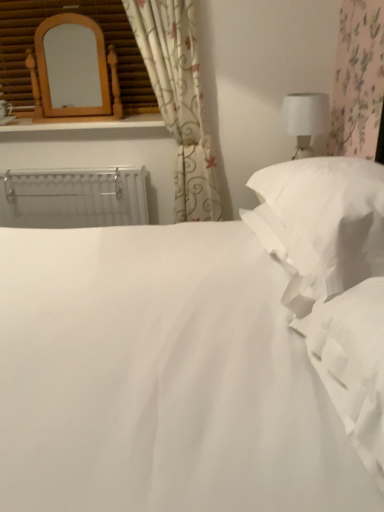
Question: Is white metallic radiator at left positioned in front of white fabric at right?

Choices:
 (A) no
 (B) yes

Answer: (A)

Question: Does white metallic radiator at left have a larger size compared to white fabric at right?

Choices:
 (A) no
 (B) yes

Answer: (B)

Question: Does white metallic radiator at left have a smaller size compared to white fabric at right?

Choices:
 (A) no
 (B) yes

Answer: (A)

Question: Is there a large distance between white metallic radiator at left and white fabric at right?

Choices:
 (A) yes
 (B) no

Answer: (A)

Question: Is white metallic radiator at left further to the viewer compared to white fabric at right?

Choices:
 (A) yes
 (B) no

Answer: (A)

Question: Is wooden mirror at upper left to the left or to the right of white fabric at right in the image?

Choices:
 (A) right
 (B) left

Answer: (B)

Question: Considering the positions of wooden mirror at upper left and white fabric at right in the image, is wooden mirror at upper left taller or shorter than white fabric at right?

Choices:
 (A) tall
 (B) short

Answer: (A)

Question: Do you think wooden mirror at upper left is within white fabric at right, or outside of it?

Choices:
 (A) outside
 (B) inside

Answer: (A)

Question: Is point (72, 8) positioned closer to the camera than point (367, 314)?

Choices:
 (A) farther
 (B) closer

Answer: (A)

Question: From a real-world perspective, relative to wooden mirror at upper left, is floral fabric curtain at upper left vertically above or below?

Choices:
 (A) below
 (B) above

Answer: (A)

Question: Is floral fabric curtain at upper left in front of or behind wooden mirror at upper left in the image?

Choices:
 (A) front
 (B) behind

Answer: (A)

Question: From the image's perspective, is floral fabric curtain at upper left above or below wooden mirror at upper left?

Choices:
 (A) below
 (B) above

Answer: (A)

Question: Is point (213, 187) closer or farther from the camera than point (117, 15)?

Choices:
 (A) farther
 (B) closer

Answer: (A)

Question: Is point (365, 453) closer or farther from the camera than point (365, 248)?

Choices:
 (A) closer
 (B) farther

Answer: (A)

Question: Considering the positions of white fabric at right and white soft pillow at right in the image, is white fabric at right wider or thinner than white soft pillow at right?

Choices:
 (A) wide
 (B) thin

Answer: (B)